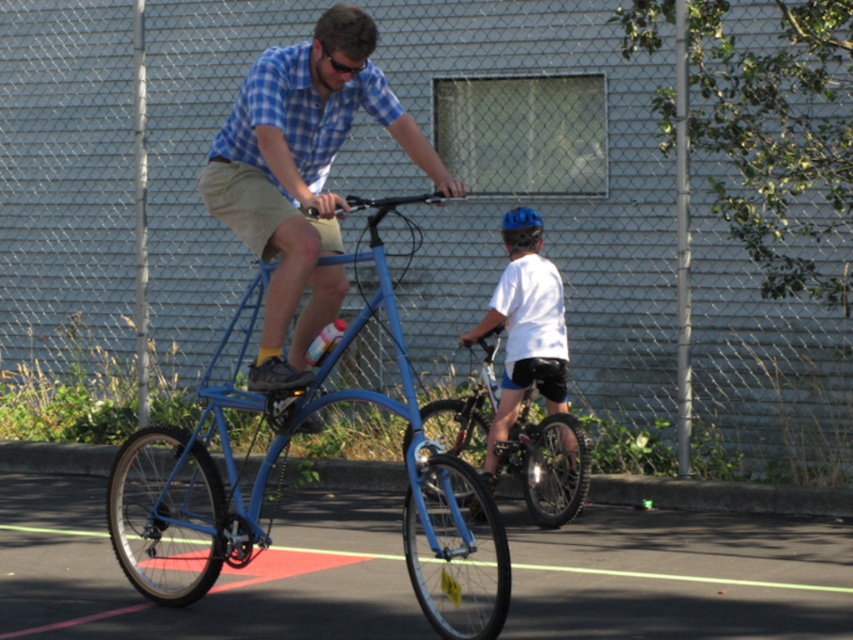
Looking at this image, does blue matte bicycle at center appear under metallic silver bicycle at center?

Indeed, blue matte bicycle at center is positioned under metallic silver bicycle at center.

Describe the element at coordinates (271, 467) in the screenshot. I see `blue matte bicycle at center` at that location.

You are a GUI agent. You are given a task and a screenshot of the screen. Output one action in this format:
    pyautogui.click(x=<x>, y=<y>)
    Task: Click on the blue matte bicycle at center
    The width and height of the screenshot is (853, 640).
    Given the screenshot: What is the action you would take?
    pyautogui.click(x=271, y=467)

The height and width of the screenshot is (640, 853). What are the coordinates of `matte blue bicycle at center` in the screenshot? It's located at (302, 173).

Is matte blue bicycle at center closer to the viewer compared to white matte shirt at center?

Yes, matte blue bicycle at center is in front of white matte shirt at center.

Which is in front, point (325, 81) or point (566, 337)?

Point (325, 81)

Locate an element on the screen. matte blue bicycle at center is located at coordinates (302, 173).

Measure the distance between blue matte bicycle at center and white matte shirt at center.

A distance of 5.67 feet exists between blue matte bicycle at center and white matte shirt at center.

Is point (204, 579) more distant than point (525, 349)?

That is False.

You are a GUI agent. You are given a task and a screenshot of the screen. Output one action in this format:
    pyautogui.click(x=<x>, y=<y>)
    Task: Click on the blue matte bicycle at center
    The width and height of the screenshot is (853, 640).
    Given the screenshot: What is the action you would take?
    pyautogui.click(x=271, y=467)